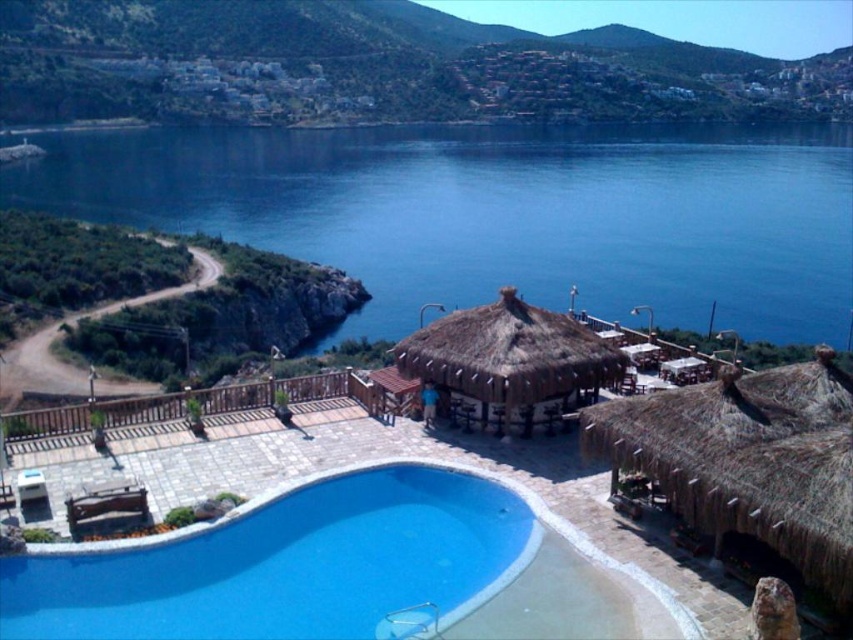
Does point (328, 262) come farther from viewer compared to point (479, 397)?

Yes, point (328, 262) is behind point (479, 397).

Between blue water at upper center and brown thatch hut at center, which one is positioned lower?

Positioned lower is brown thatch hut at center.

Between point (670, 305) and point (573, 340), which one is positioned in front?

Point (573, 340)

This screenshot has height=640, width=853. I want to click on blue water at upper center, so click(498, 212).

Is blue water at upper center positioned behind blue smooth pool at center?

Yes.

From the picture: Who is more forward, [221,140] or [294,525]?

Positioned in front is point [294,525].

Is point (743, 259) in front of point (194, 566)?

No, (743, 259) is behind (194, 566).

Locate an element on the screen. The height and width of the screenshot is (640, 853). blue water at upper center is located at coordinates (498, 212).

Looking at this image, is thatched straw hut at lower right further to camera compared to brown thatch hut at center?

That is False.

Is thatched straw hut at lower right to the left of brown thatch hut at center from the viewer's perspective?

Incorrect, thatched straw hut at lower right is not on the left side of brown thatch hut at center.

Is point (717, 401) farther from camera compared to point (548, 394)?

No, (717, 401) is closer to viewer.

Locate an element on the screen. thatched straw hut at lower right is located at coordinates (747, 460).